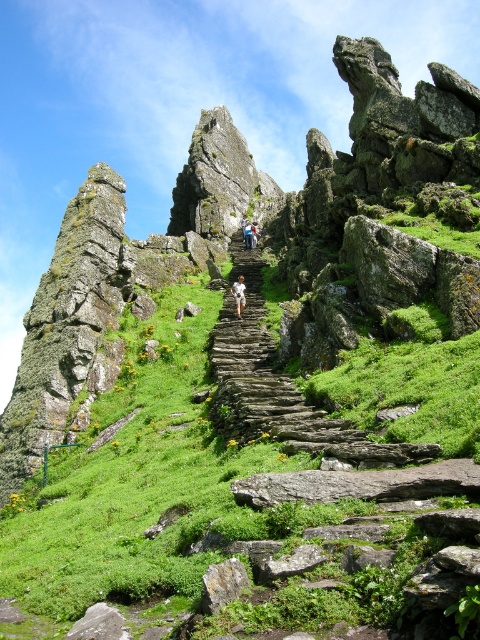
Looking at this image, how far apart are green mossy stairs at center and light brown leather jacket at center?

A distance of 30.12 meters exists between green mossy stairs at center and light brown leather jacket at center.

The height and width of the screenshot is (640, 480). Describe the element at coordinates (233, 483) in the screenshot. I see `green mossy stairs at center` at that location.

Which is in front, point (34, 584) or point (242, 300)?

Point (34, 584)

You are a GUI agent. You are given a task and a screenshot of the screen. Output one action in this format:
    pyautogui.click(x=<x>, y=<y>)
    Task: Click on the green mossy stairs at center
    This screenshot has height=640, width=480.
    Given the screenshot: What is the action you would take?
    pyautogui.click(x=233, y=483)

From the picture: Between green mossy stairs at center and rustic stone stairs at center, which one is positioned higher?

rustic stone stairs at center

Where is `green mossy stairs at center`? green mossy stairs at center is located at coordinates (233, 483).

Where is `green mossy stairs at center`? green mossy stairs at center is located at coordinates [x=233, y=483].

Does rustic stone stairs at center appear under light brown leather jacket at center?

Yes, rustic stone stairs at center is below light brown leather jacket at center.

Which is behind, point (279, 408) or point (239, 296)?

Positioned behind is point (239, 296).

Describe the element at coordinates (276, 387) in the screenshot. I see `rustic stone stairs at center` at that location.

What are the coordinates of `rustic stone stairs at center` in the screenshot? It's located at (276, 387).